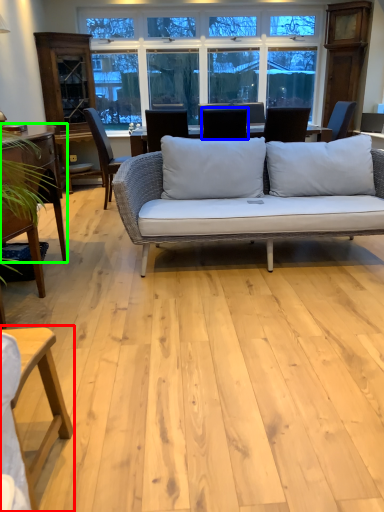
Question: Estimate the real-world distances between objects in this image. Which object is farther from table (highlighted by a red box), chair (highlighted by a blue box) or table (highlighted by a green box)?

Choices:
 (A) chair
 (B) table

Answer: (A)